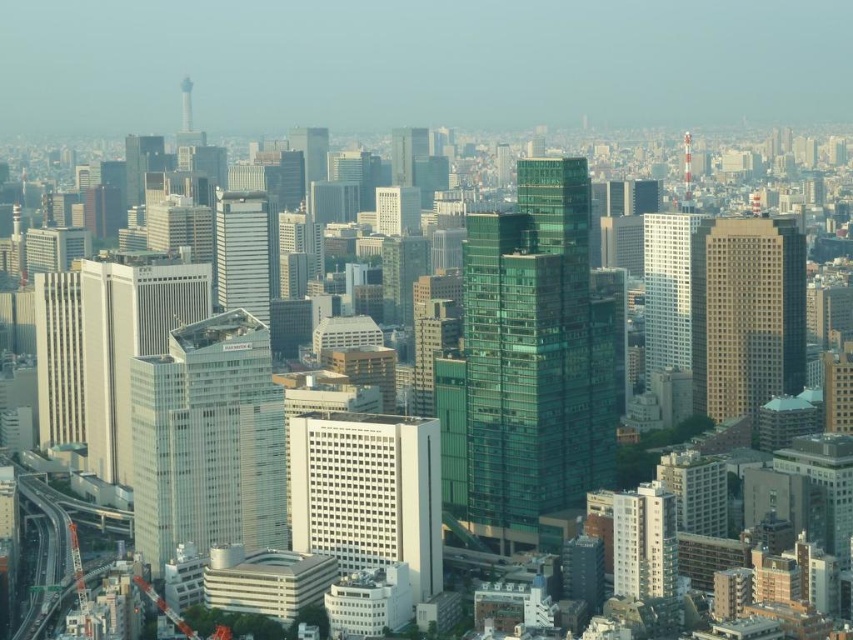
You are a city planner analyzing the urban layout. You notice the white glass building at center and the matte glass skyscraper at center. Which of these two structures takes up more area in the cityscape?

The matte glass skyscraper at center occupies more space than the white glass building at center according to the description.

From the picture: You are a city planner assessing the space between two white buildings in the city center. The buildings are labeled as the white glass building at center and the white matte building at center. Given that the minimum required distance between such structures for safety regulations is 15 meters, can the current spacing between these two buildings meet the safety standards?

The white glass building at center and the white matte building at center are 14.30 meters apart, which is less than the required 15 meters for safety regulations. Therefore, the current spacing does not meet the safety standards.

You are standing at the point with coordinates (207,440) in the city. What type of building are you directly in front of?

You are directly in front of the white glass building at center located at point (207,440).